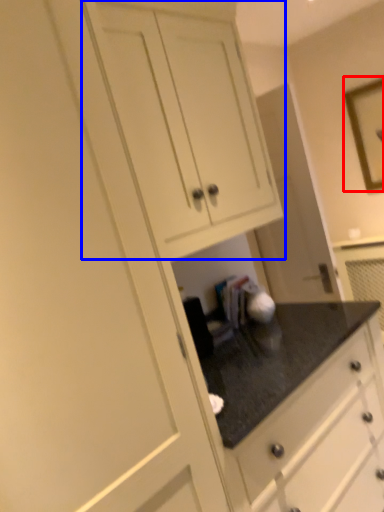
Question: Which point is further to the camera, picture frame (highlighted by a red box) or cabinetry (highlighted by a blue box)?

Choices:
 (A) picture frame
 (B) cabinetry

Answer: (A)